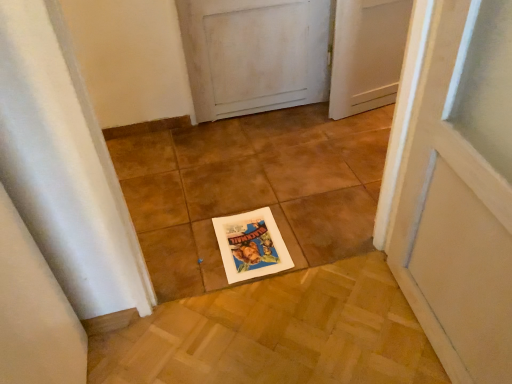
The image size is (512, 384). Find the location of `vacant space situated above white paper postcard at center (from a real-world perspective)`. vacant space situated above white paper postcard at center (from a real-world perspective) is located at coordinates (246, 236).